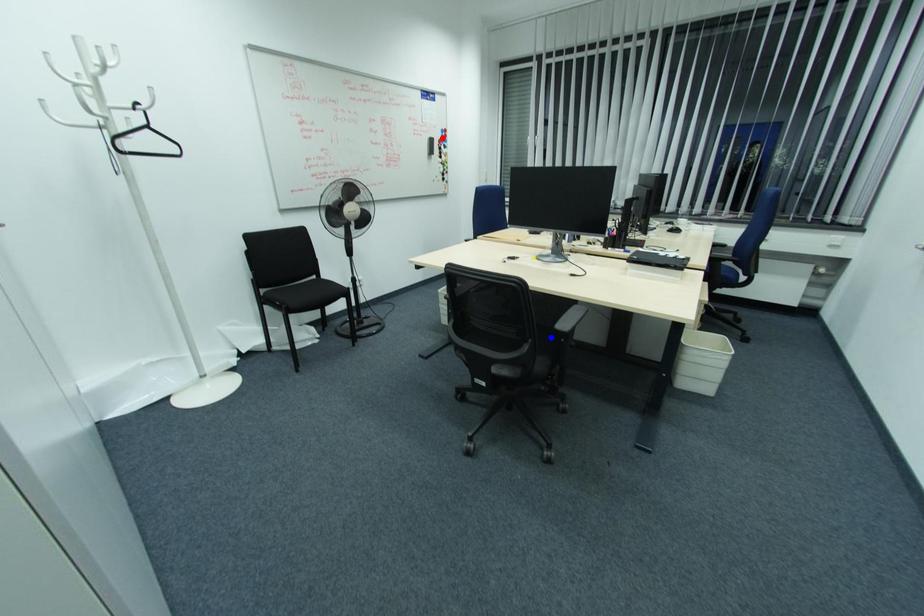
Question: In the image, two points are highlighted. Which point is nearer to the camera? Reply with the corresponding letter.

Choices:
 (A) blue point
 (B) red point

Answer: (A)